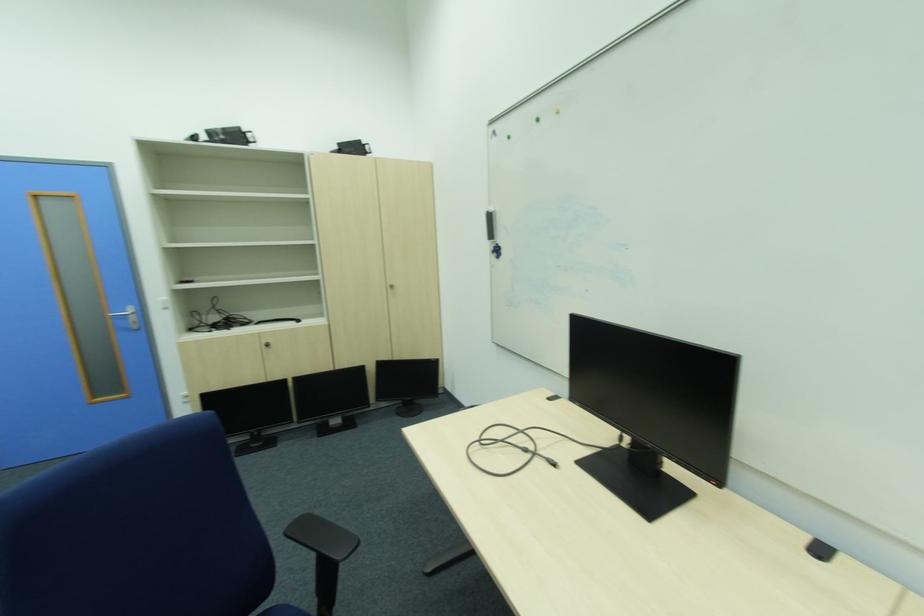
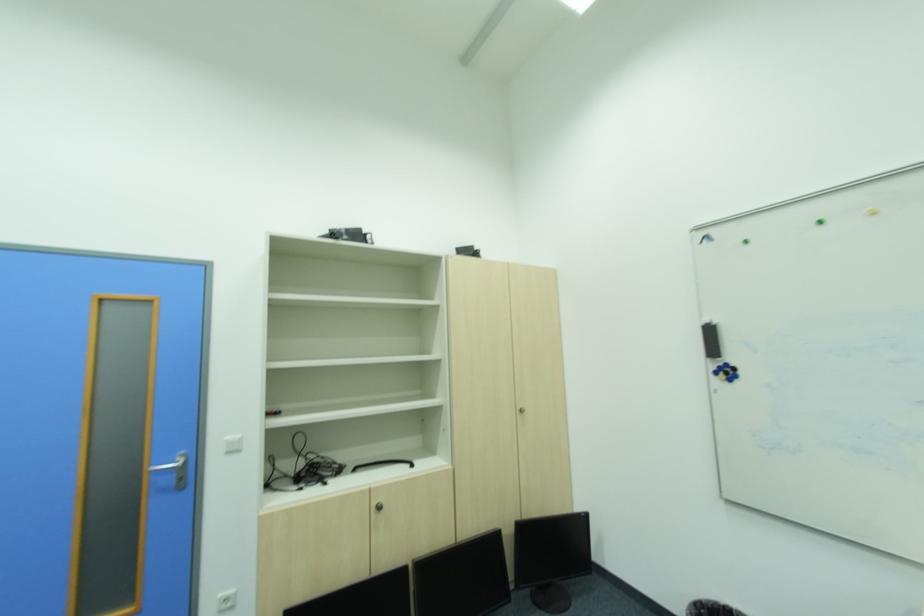
In the second image, find the point that corresponds to the point at 505,251 in the first image.

(736, 371)